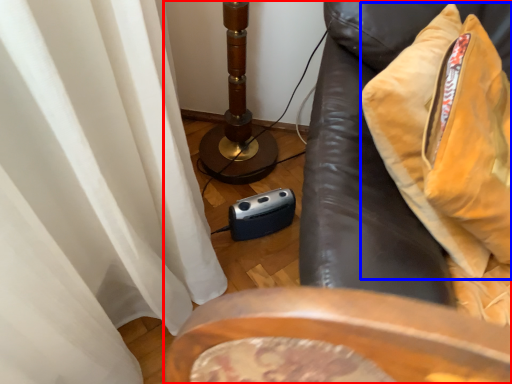
Question: Among these objects, which one is farthest to the camera, furniture (highlighted by a red box) or throw pillow (highlighted by a blue box)?

Choices:
 (A) furniture
 (B) throw pillow

Answer: (B)